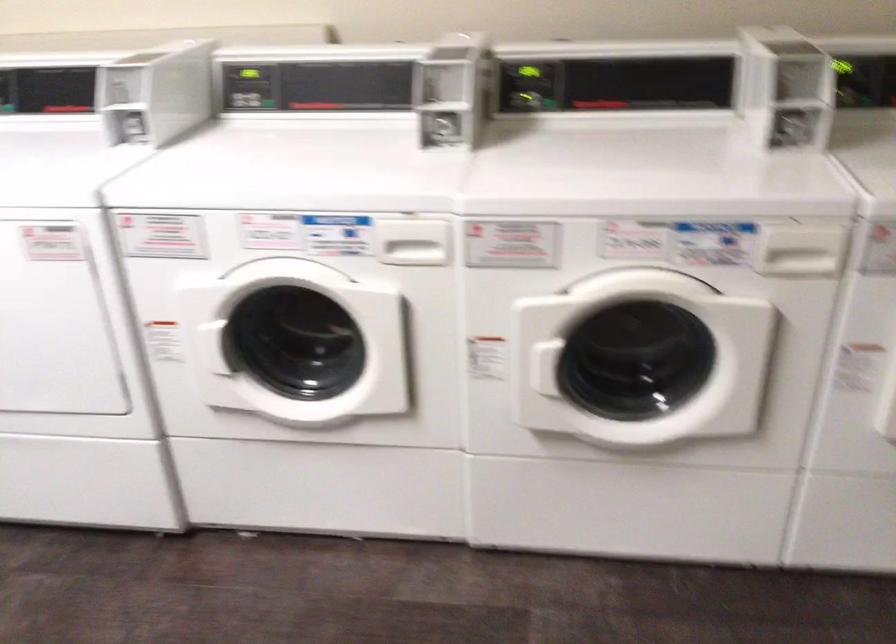
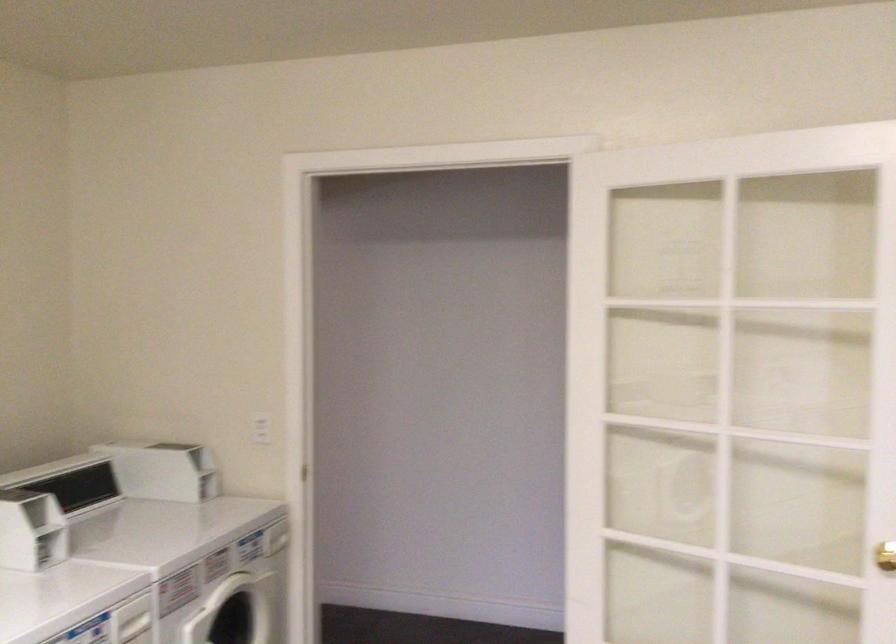
Find the pixel in the second image that matches (x=745, y=100) in the first image.

(30, 529)